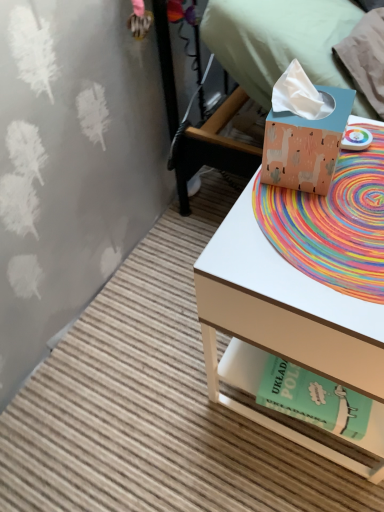
Find the location of a particular element. free space above green paper at lower right (from a real-world perspective) is located at coordinates (315, 391).